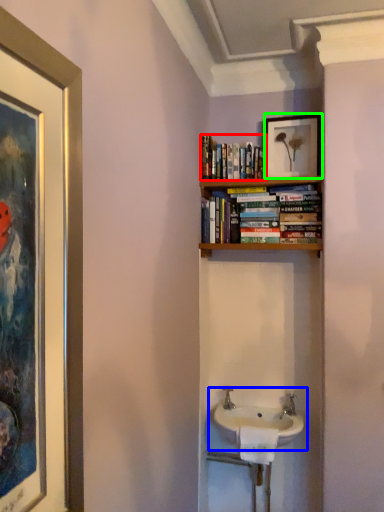
Question: Which object is the farthest from book (highlighted by a red box)? Choose among these: sink (highlighted by a blue box) or picture frame (highlighted by a green box).

Choices:
 (A) sink
 (B) picture frame

Answer: (A)